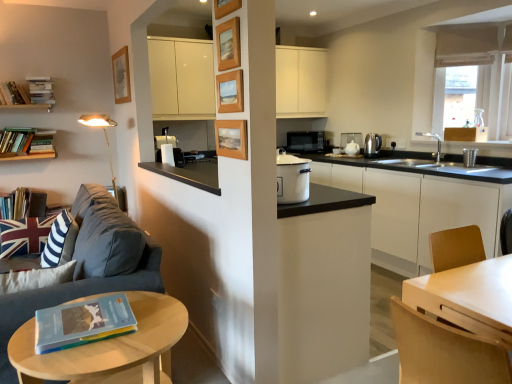
The width and height of the screenshot is (512, 384). Identify the location of vacant area that is in front of hardcover book at lower left, the 1th book from the bottom. (68, 362).